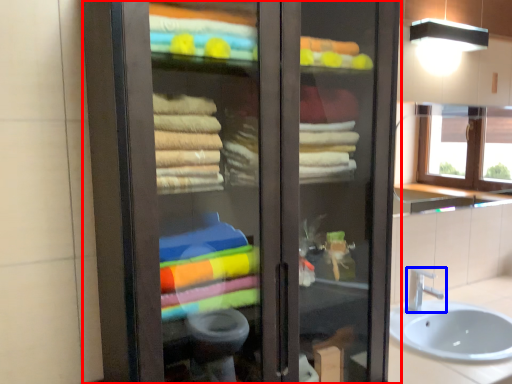
Question: Which object is closer to the camera taking this photo, bathroom cabinet (highlighted by a red box) or tap (highlighted by a blue box)?

Choices:
 (A) bathroom cabinet
 (B) tap

Answer: (A)